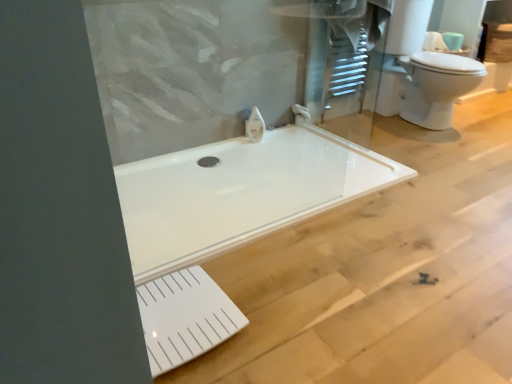
This screenshot has height=384, width=512. Identify the location of vacant space in front of white glossy faucet at upper center, positioned as the second faucet in back-to-front order. (254, 149).